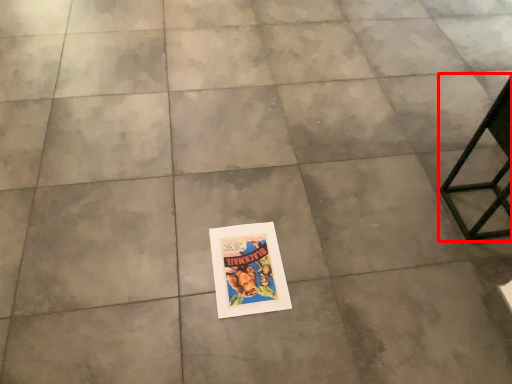
Question: From the image's perspective, what is the correct spatial relationship of furniture (annotated by the red box) in relation to poster?

Choices:
 (A) below
 (B) above

Answer: (B)